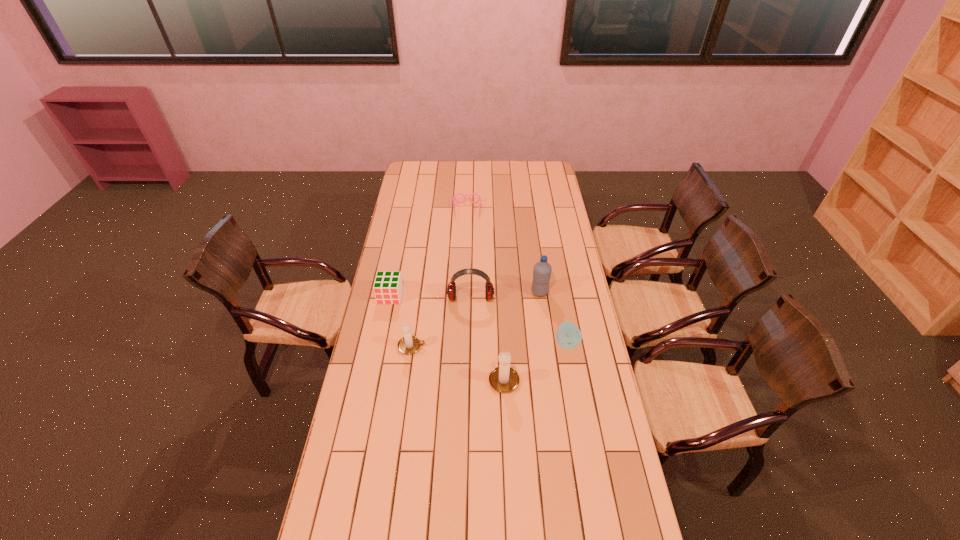
Where is `vacant space situated 0.320m on the handle side of the farther candle holder`? vacant space situated 0.320m on the handle side of the farther candle holder is located at coordinates (505, 347).

Where is `vacant area situated on the handle side of the nearer candle holder`? The image size is (960, 540). vacant area situated on the handle side of the nearer candle holder is located at coordinates (502, 331).

Identify the location of blank area located on the handle side of the nearer candle holder. Image resolution: width=960 pixels, height=540 pixels. (500, 291).

The image size is (960, 540). Identify the location of blank space located on the handle side of the nearer candle holder. (501, 326).

Find the location of a particular element. vacant area located on the arms of the farthest object is located at coordinates (467, 228).

At what (x,y) coordinates should I click in order to perform the action: click on vacant space located 0.270m on the ear cups of the earphone. Please return your answer as a coordinate pair (x, y). The image size is (960, 540). Looking at the image, I should click on (469, 356).

I want to click on free space located 0.080m on the front of the apple, so click(x=571, y=370).

Image resolution: width=960 pixels, height=540 pixels. I want to click on vacant point located 0.360m on the red face of the cube, so click(374, 375).

Locate an element on the screen. The height and width of the screenshot is (540, 960). free region located 0.360m on the back of the water bottle is located at coordinates (532, 237).

At what (x,y) coordinates should I click in order to perform the action: click on candle holder at the left edge. Please return your answer as a coordinate pair (x, y). The height and width of the screenshot is (540, 960). Looking at the image, I should click on (409, 344).